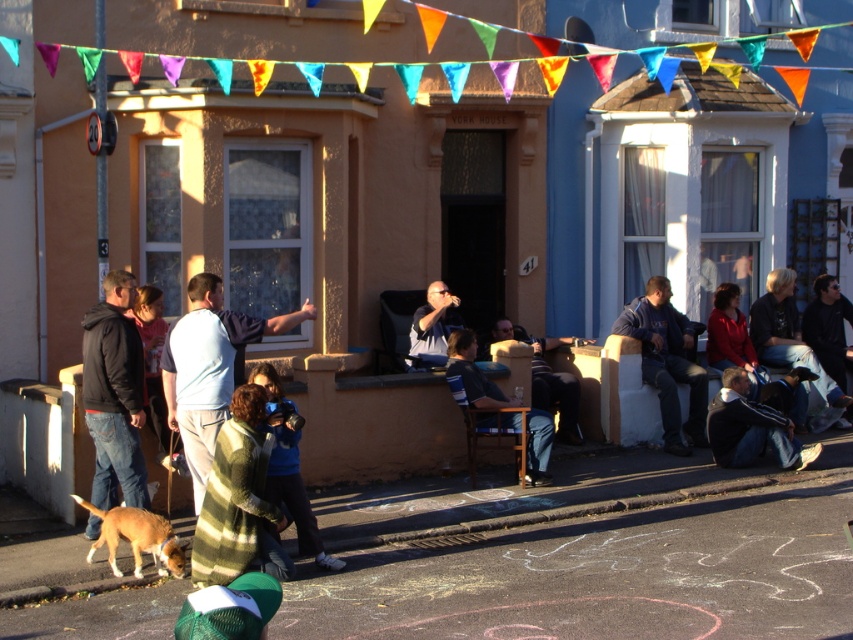
You are a photographer setting up a tripod in the middle of the street. You notice two pairs of dark blue jeans at lower right and dark blue jeans at right. Which pair of dark blue jeans is wider?

The dark blue jeans at right is wider than the dark blue jeans at lower right.

You are a photographer standing in the street scene and want to take a picture of both the light blue shirt at center and the dark blue jeans at lower right. Which object should you focus on first to ensure both are in sharp focus?

You should focus on the light blue shirt at center first because it is closer to the viewer than the dark blue jeans at lower right, ensuring both will be in focus when using a proper depth of field.

You are standing on the street looking at the festive decorations. There are two points marked in the image. One is at coordinate point (x=811, y=451) and the other is at point (x=769, y=316). Which of these two points is closer to you?

Point (x=811, y=451) is closer to the viewer than point (x=769, y=316).